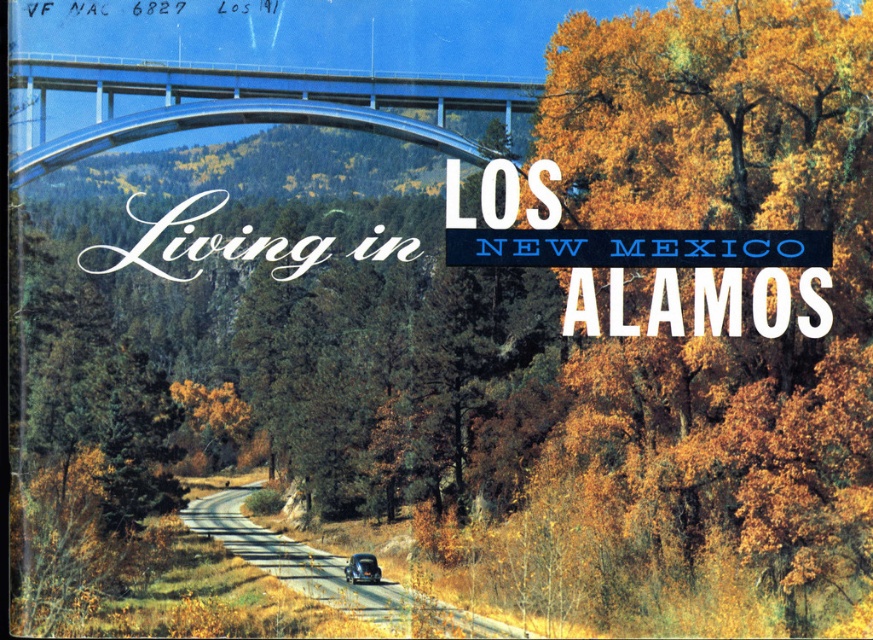
You are driving a car and see the point at (322, 112) and the point at (377, 580) on your GPS. Which point is closer to your current location?

The point at (322, 112) is closer to your current location because it is in front of the point at (377, 580).

You are driving a shiny black car at center on a smooth asphalt road at center. You need to make an emergency stop. Is the road in front of your car clear enough to stop safely?

The smooth asphalt road at center is in front of the shiny black car at center, so yes, the road in front of the shiny black car at center is clear enough to stop safely.

You are a drone operator trying to capture aerial footage of the scenic bridge in Los Alamos. Your drone has a height limit of 10 meters. The smooth asphalt road at center and the shiny black car at center are both in your camera frame. Considering their heights, can your drone safely fly above both without exceeding its height limit?

The smooth asphalt road at center has a greater height compared to the shiny black car at center. Since the road is higher, the drone must fly above the road. If the road is below the 10 meter limit, then it can safely fly. However, without exact measurements, we can only confirm the road is taller than the car. Assuming the road is within the 10m limit, the drone can fly safely above both.